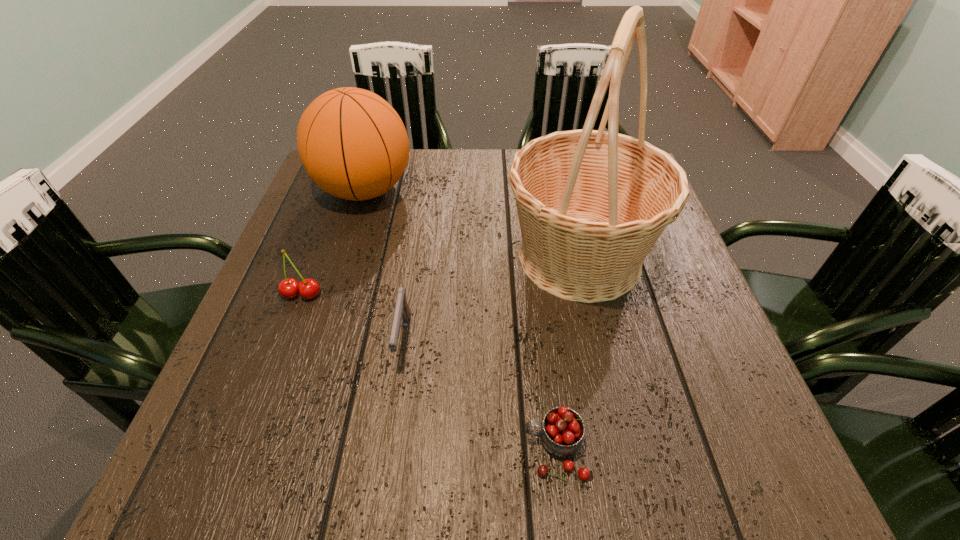
Locate an element on the screen. free spot at the near edge of the desktop is located at coordinates (369, 447).

You are a GUI agent. You are given a task and a screenshot of the screen. Output one action in this format:
    pyautogui.click(x=<x>, y=<y>)
    Task: Click on the free point at the left edge
    The height and width of the screenshot is (540, 960).
    Given the screenshot: What is the action you would take?
    pyautogui.click(x=286, y=300)

Locate an element on the screen. free space at the right edge of the desktop is located at coordinates (624, 307).

Where is `free space at the far left corner of the desktop`? The height and width of the screenshot is (540, 960). free space at the far left corner of the desktop is located at coordinates (320, 197).

The width and height of the screenshot is (960, 540). Identify the location of free space between the left cherry and the basketball. (333, 242).

Where is `empty space that is in between the pistol and the second tallest object`? The image size is (960, 540). empty space that is in between the pistol and the second tallest object is located at coordinates (384, 265).

You are a GUI agent. You are given a task and a screenshot of the screen. Output one action in this format:
    pyautogui.click(x=<x>, y=<y>)
    Task: Click on the unoccupied area between the basketball and the basket
    
    Given the screenshot: What is the action you would take?
    pyautogui.click(x=472, y=224)

This screenshot has height=540, width=960. I want to click on free space between the nearest object and the farther cherry, so click(x=428, y=372).

The width and height of the screenshot is (960, 540). I want to click on free space between the right cherry and the pistol, so click(x=479, y=395).

Where is `free space between the third object from right to left and the basket`? The width and height of the screenshot is (960, 540). free space between the third object from right to left and the basket is located at coordinates (492, 299).